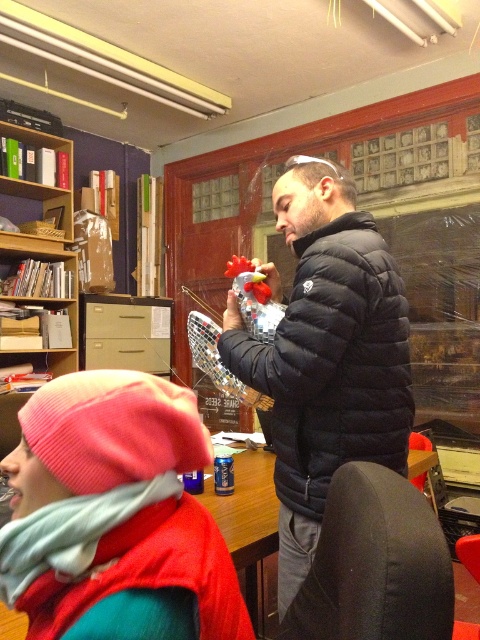
Is pink knit beanie at upper left bigger than wooden table at center?

No, pink knit beanie at upper left is not bigger than wooden table at center.

Locate an element on the screen. This screenshot has height=640, width=480. pink knit beanie at upper left is located at coordinates (113, 429).

Describe the element at coordinates (334, 362) in the screenshot. I see `black puffy jacket at center` at that location.

Is black puffy jacket at center shorter than wooden bookshelf at upper left?

Correct, black puffy jacket at center is not as tall as wooden bookshelf at upper left.

Measure the distance between black puffy jacket at center and camera.

black puffy jacket at center and camera are 1.10 meters apart from each other.

Find the location of a particular element. The width and height of the screenshot is (480, 640). black puffy jacket at center is located at coordinates (334, 362).

Between black puffy jacket at center and wooden table at center, which one appears on the left side from the viewer's perspective?

wooden table at center

Does point (363, 412) come closer to viewer compared to point (269, 460)?

Yes, point (363, 412) is in front of point (269, 460).

Which is in front, point (279, 448) or point (245, 596)?

Positioned in front is point (279, 448).

Locate an element on the screen. The height and width of the screenshot is (640, 480). black puffy jacket at center is located at coordinates (334, 362).